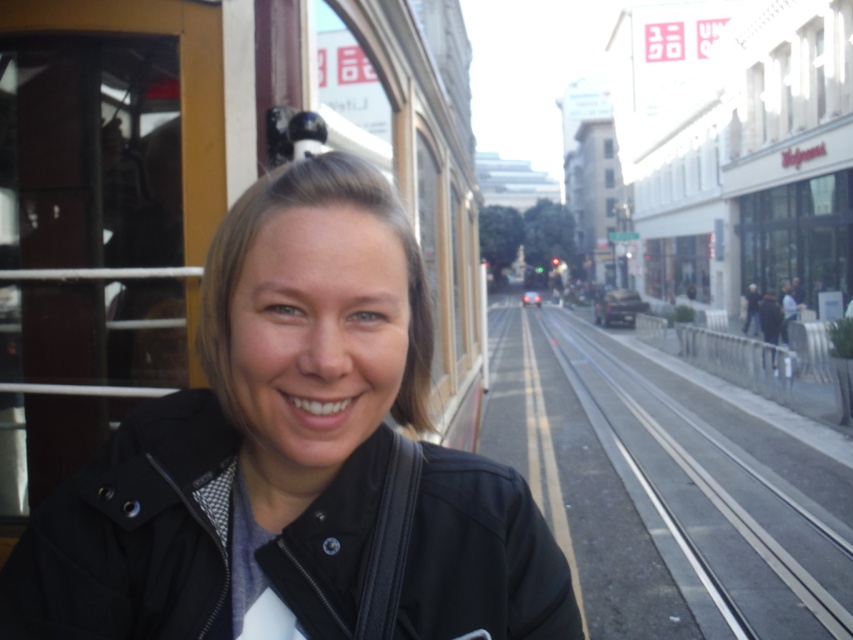
Question: Which of the following is the farthest from the observer?

Choices:
 (A) (346, 268)
 (B) (802, 598)

Answer: (B)

Question: Is black matte jacket at left smaller than metal train track at center?

Choices:
 (A) no
 (B) yes

Answer: (B)

Question: From the image, what is the correct spatial relationship of black matte jacket at left in relation to metal train track at center?

Choices:
 (A) right
 (B) left

Answer: (B)

Question: Is black matte jacket at left above metal train track at center?

Choices:
 (A) no
 (B) yes

Answer: (B)

Question: Which object appears farthest from the camera in this image?

Choices:
 (A) metal train track at center
 (B) black matte jacket at left

Answer: (A)